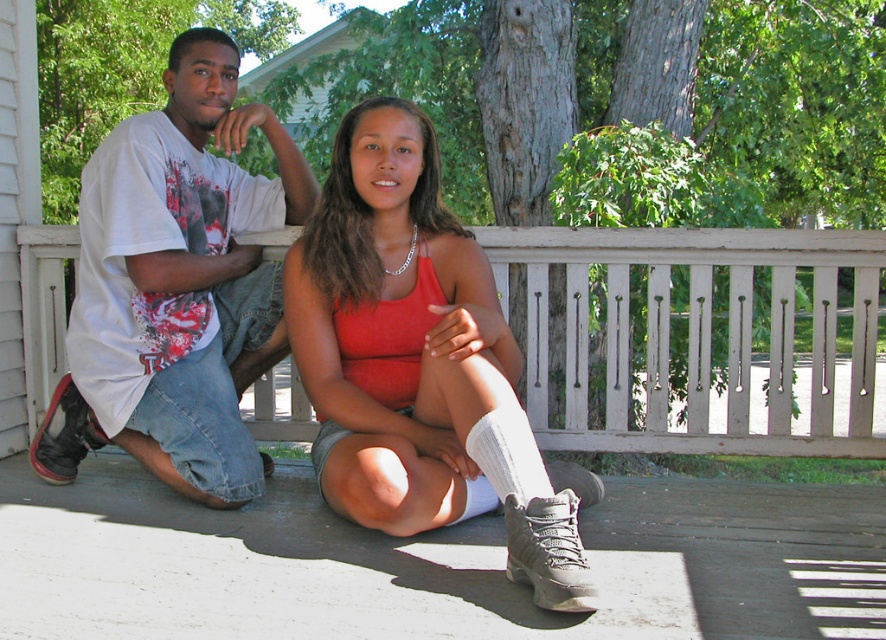
Question: Which point appears closest to the camera in this image?

Choices:
 (A) (43, 458)
 (B) (881, 314)
 (C) (488, 435)
 (D) (159, 164)

Answer: (C)

Question: Is white wooden porch at center smaller than white knit sock at lower center?

Choices:
 (A) no
 (B) yes

Answer: (A)

Question: Which object is closer to the camera taking this photo?

Choices:
 (A) white knit sock at lower center
 (B) matte white t-shirt at left

Answer: (A)

Question: Which point is farther to the camera?

Choices:
 (A) white cotton t-shirt at left
 (B) white knit sock at lower center

Answer: (A)

Question: Is matte white t-shirt at left above white cotton t-shirt at left?

Choices:
 (A) no
 (B) yes

Answer: (A)

Question: Does white wooden porch at center appear on the left side of white cotton t-shirt at left?

Choices:
 (A) no
 (B) yes

Answer: (A)